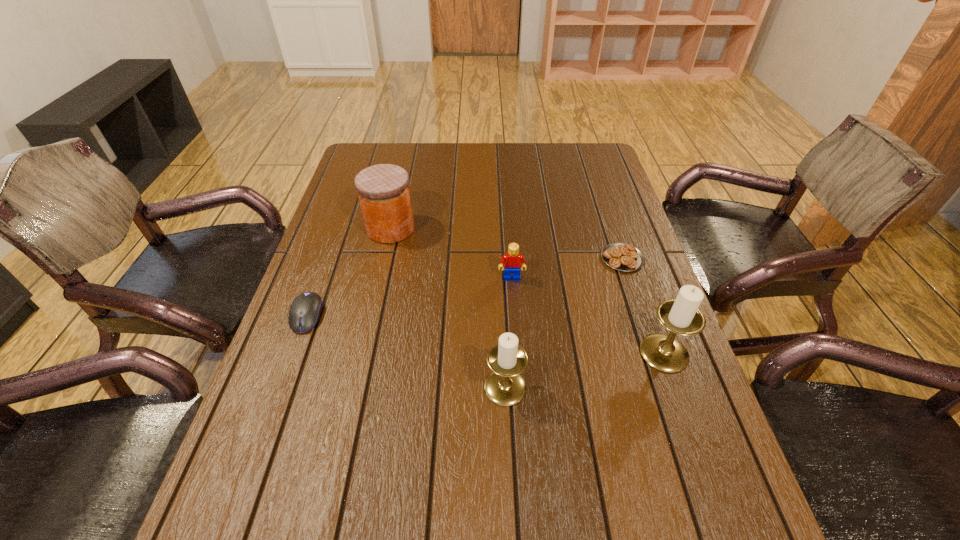
The height and width of the screenshot is (540, 960). Find the location of `pastry`. pastry is located at coordinates (621, 256).

The width and height of the screenshot is (960, 540). Find the location of `vacant space situated 0.150m on the left of the left candle holder`. vacant space situated 0.150m on the left of the left candle holder is located at coordinates (413, 387).

Where is `vacant region located 0.310m on the back of the right candle holder`? The width and height of the screenshot is (960, 540). vacant region located 0.310m on the back of the right candle holder is located at coordinates (626, 246).

Locate an element on the screen. This screenshot has width=960, height=540. free location located 0.200m on the back of the leftmost object is located at coordinates 332,246.

Locate an element on the screen. free spot located 0.060m on the right of the farthest object is located at coordinates (436, 228).

This screenshot has width=960, height=540. I want to click on free space located on the front-facing side of the fourth nearest object, so click(x=516, y=333).

The height and width of the screenshot is (540, 960). I want to click on vacant region located 0.290m on the left of the pastry, so click(495, 259).

The height and width of the screenshot is (540, 960). I want to click on computer mouse that is at the left edge, so click(305, 310).

Identify the location of jar that is at the left edge. (383, 190).

Where is `candle holder positioned at the right edge`? Image resolution: width=960 pixels, height=540 pixels. candle holder positioned at the right edge is located at coordinates pyautogui.click(x=681, y=316).